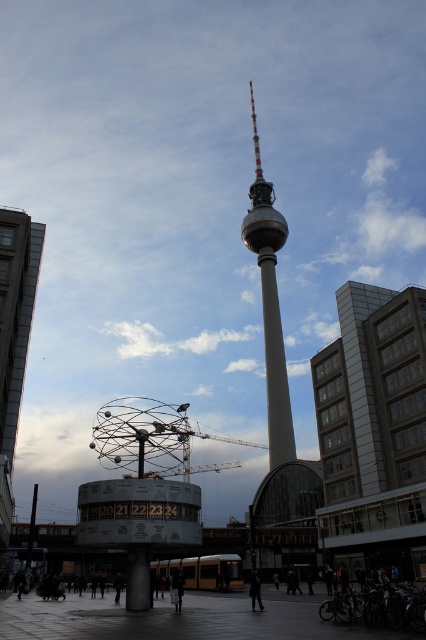
Does metallic pole at lower left have a larger size compared to dark gray pants at center?

Correct, metallic pole at lower left is larger in size than dark gray pants at center.

Is metallic pole at lower left in front of dark gray pants at center?

No.

I want to click on metallic pole at lower left, so click(31, 532).

Who is higher up, gray concrete building at right or dark gray pants at center?

Positioned higher is gray concrete building at right.

Who is more distant from viewer, (408, 570) or (176, 588)?

The point (408, 570) is more distant.

Which is in front, point (342, 548) or point (178, 589)?

Point (178, 589)

Locate an element on the screen. gray concrete building at right is located at coordinates (374, 429).

Image resolution: width=426 pixels, height=640 pixels. In order to click on smooth gray tower at center in this screenshot , I will do pos(270,305).

Is point (256, 193) more distant than point (256, 586)?

Yes, point (256, 193) is behind point (256, 586).

This screenshot has height=640, width=426. I want to click on smooth gray tower at center, so click(270, 305).